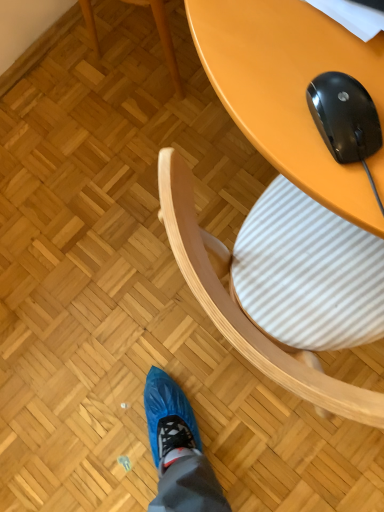
Identify the location of free space to the left of wooden chair at upper center. (77, 95).